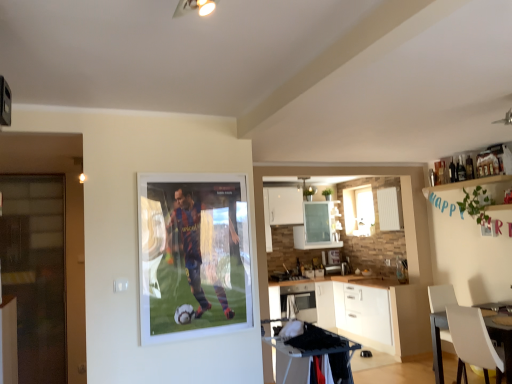
Question: Is white glossy window at center not close to transparent glass door at left?

Choices:
 (A) yes
 (B) no

Answer: (A)

Question: From the image's perspective, does white glossy window at center appear lower than transparent glass door at left?

Choices:
 (A) no
 (B) yes

Answer: (A)

Question: Is white glossy window at center behind transparent glass door at left?

Choices:
 (A) no
 (B) yes

Answer: (B)

Question: From a real-world perspective, is white glossy window at center on top of transparent glass door at left?

Choices:
 (A) no
 (B) yes

Answer: (B)

Question: Considering the relative sizes of white glossy window at center and transparent glass door at left in the image provided, is white glossy window at center shorter than transparent glass door at left?

Choices:
 (A) no
 (B) yes

Answer: (B)

Question: Is white glossy window at center thinner than transparent glass door at left?

Choices:
 (A) no
 (B) yes

Answer: (B)

Question: Is white glossy microwave at center wider than transparent glass door at left?

Choices:
 (A) no
 (B) yes

Answer: (B)

Question: Could transparent glass door at left be considered to be inside white glossy microwave at center?

Choices:
 (A) yes
 (B) no

Answer: (B)

Question: Are white glossy microwave at center and transparent glass door at left beside each other?

Choices:
 (A) yes
 (B) no

Answer: (B)

Question: Is white glossy microwave at center further to the viewer compared to transparent glass door at left?

Choices:
 (A) no
 (B) yes

Answer: (B)

Question: From a real-world perspective, is white glossy microwave at center located higher than transparent glass door at left?

Choices:
 (A) no
 (B) yes

Answer: (A)

Question: Is white glossy microwave at center not inside transparent glass door at left?

Choices:
 (A) yes
 (B) no

Answer: (A)

Question: Is white plastic chair at lower right not inside white glossy cabinet at lower center?

Choices:
 (A) yes
 (B) no

Answer: (A)